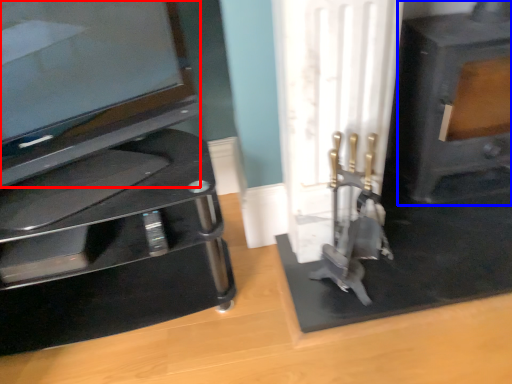
Question: Which point is closer to the camera, television (highlighted by a red box) or fireplace (highlighted by a blue box)?

Choices:
 (A) television
 (B) fireplace

Answer: (A)